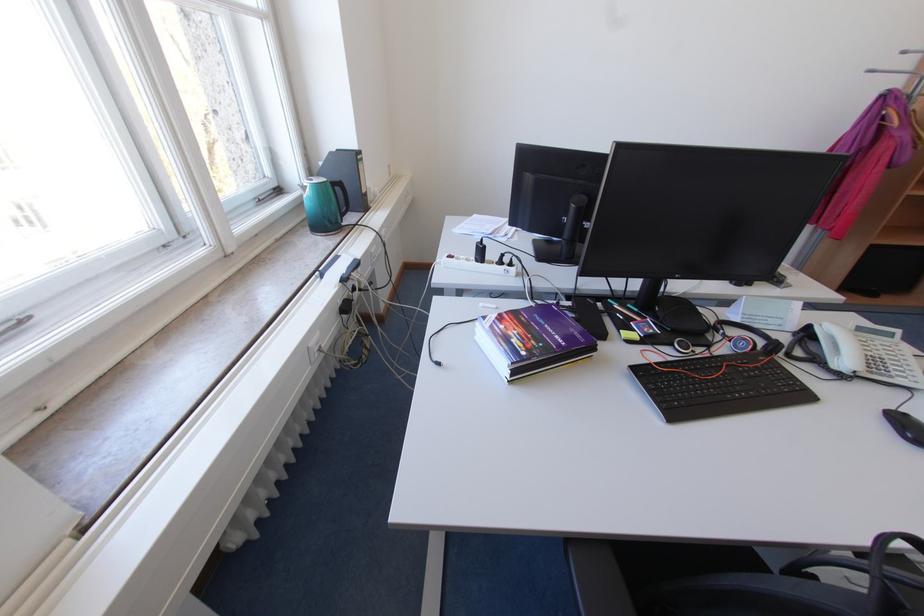
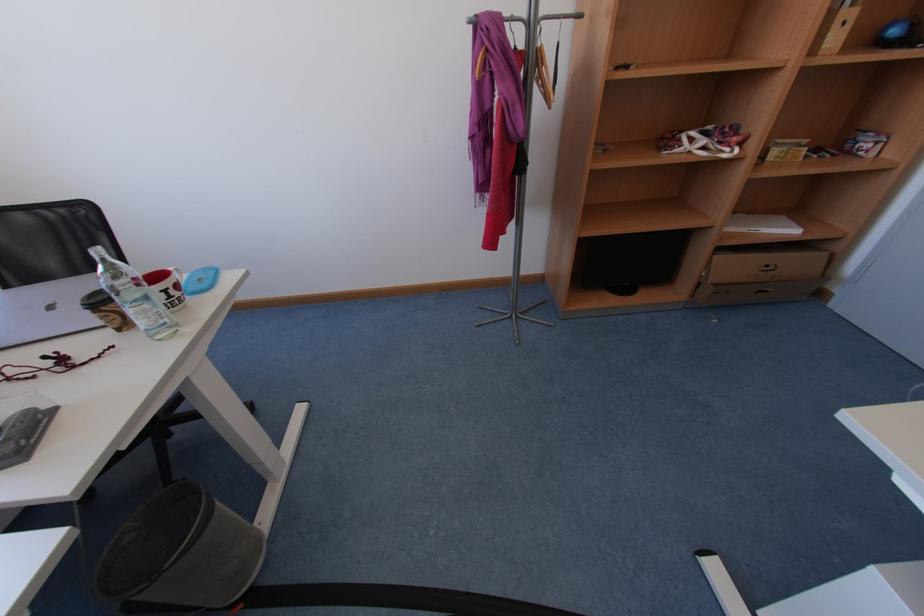
Question: In a continuous first-person perspective shot, in which direction is the camera moving?

Choices:
 (A) Left
 (B) Right
 (C) Forward
 (D) Backward

Answer: (B)